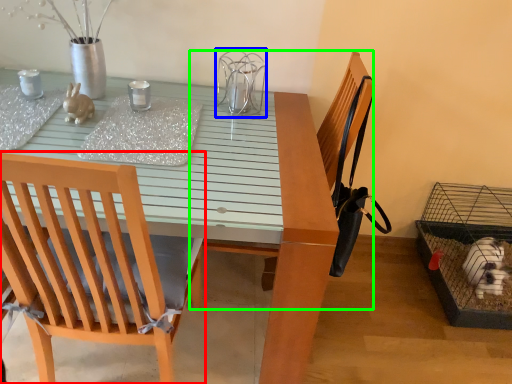
Question: Estimate the real-world distances between objects in this image. Which object is closer to chair (highlighted by a red box), bird cage (highlighted by a blue box) or armchair (highlighted by a green box)?

Choices:
 (A) bird cage
 (B) armchair

Answer: (A)